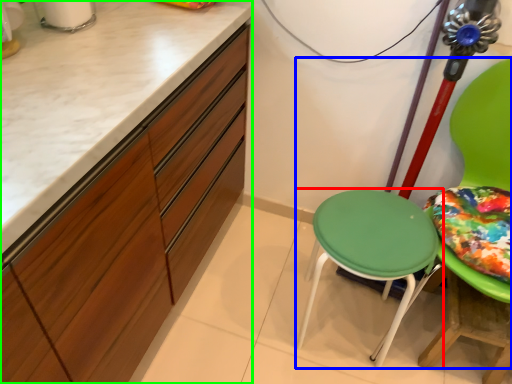
Question: Considering the real-world distances, which object is farthest from stool (highlighted by a red box)? chair (highlighted by a blue box) or cabinetry (highlighted by a green box)?

Choices:
 (A) chair
 (B) cabinetry

Answer: (B)